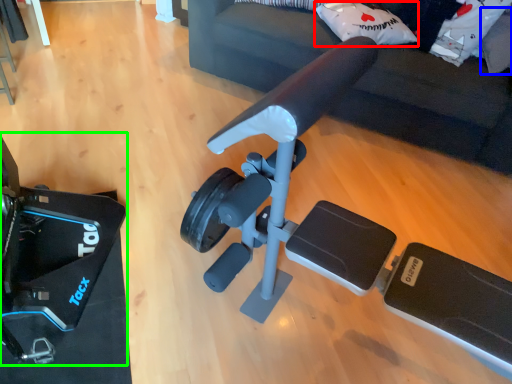
Question: Which object is the farthest from pillow (highlighted by a red box)? Choose among these: pillow (highlighted by a blue box) or video camera (highlighted by a green box).

Choices:
 (A) pillow
 (B) video camera

Answer: (B)